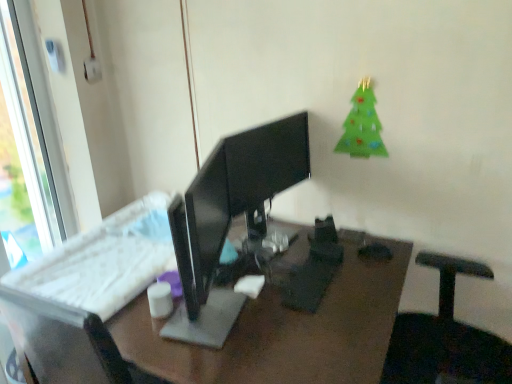
I want to click on vacant space in front of white matte cup at center, so click(x=158, y=338).